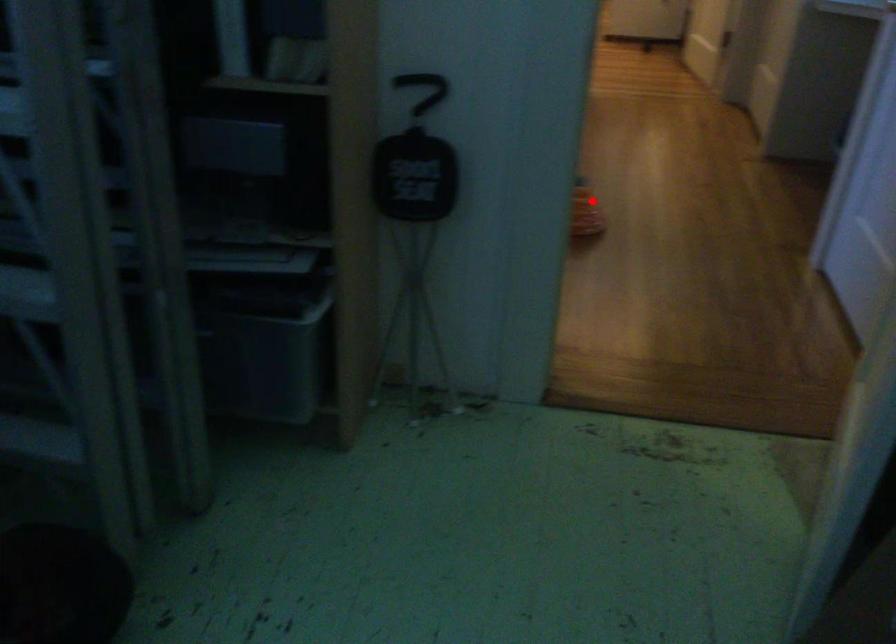
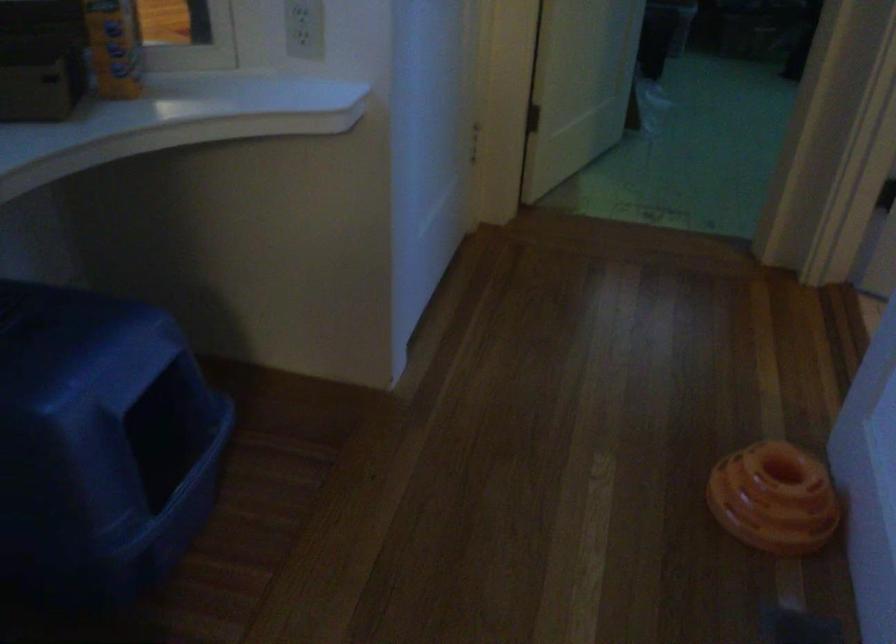
Question: I am providing you with two images of the same scene from different viewpoints. A red point is shown in image1. For the corresponding object point in image2, is it positioned nearer or farther from the camera?

Choices:
 (A) Nearer
 (B) Farther

Answer: (A)